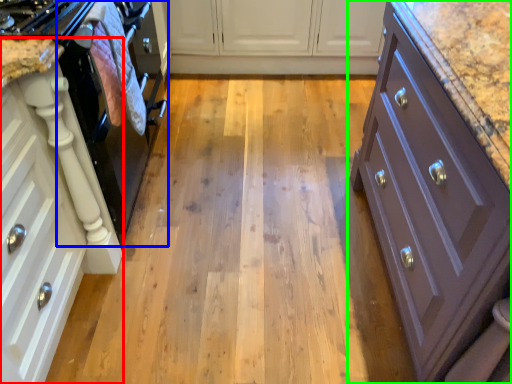
Question: Considering the real-world distances, which object is farthest from cabinetry (highlighted by a red box)? oven (highlighted by a blue box) or cabinetry (highlighted by a green box)?

Choices:
 (A) oven
 (B) cabinetry

Answer: (B)